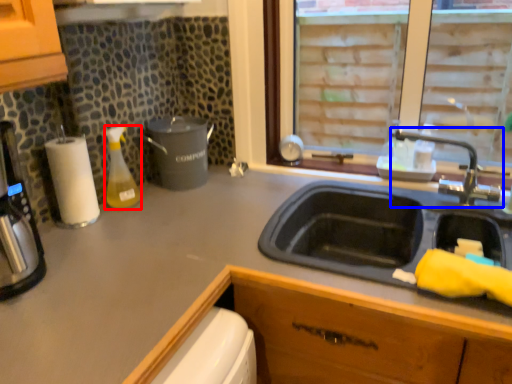
Question: Among these objects, which one is farthest to the camera, bottle (highlighted by a red box) or tap (highlighted by a blue box)?

Choices:
 (A) bottle
 (B) tap

Answer: (A)